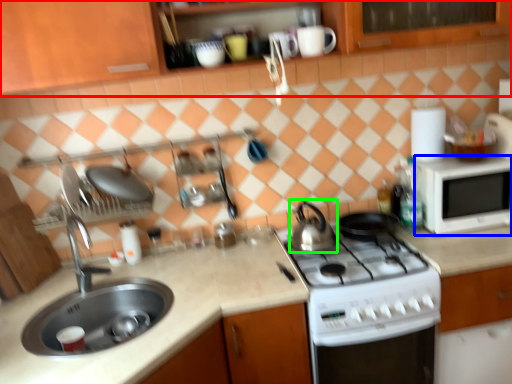
Question: Based on their relative distances, which object is farther from cabinetry (highlighted by a red box)? Choose from microwave oven (highlighted by a blue box) and tea pot (highlighted by a green box).

Choices:
 (A) microwave oven
 (B) tea pot

Answer: (B)